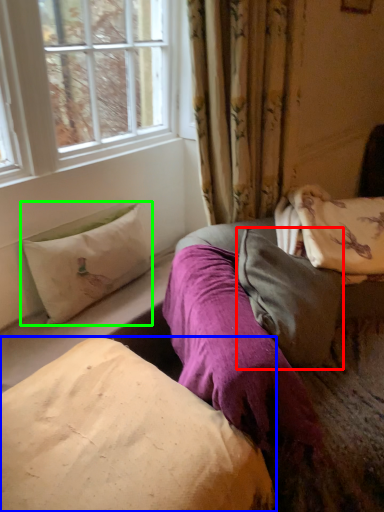
Question: Based on their relative distances, which object is farther from pillow (highlighted by a red box)? Choose from pillow (highlighted by a blue box) and pillow (highlighted by a green box).

Choices:
 (A) pillow
 (B) pillow

Answer: (B)